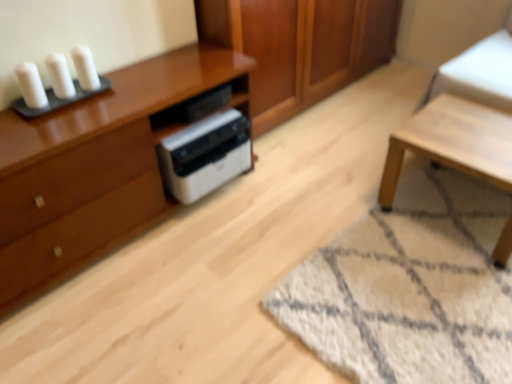
Image resolution: width=512 pixels, height=384 pixels. I want to click on vacant area that is in front of light wood table at lower right, so click(448, 290).